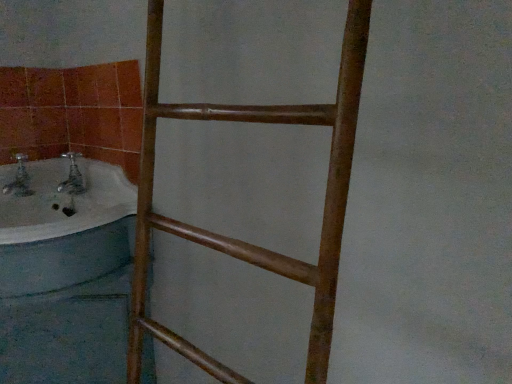
Question: Considering the positions of white glossy bathtub at left and brown wooden ladder at center in the image, is white glossy bathtub at left wider or thinner than brown wooden ladder at center?

Choices:
 (A) thin
 (B) wide

Answer: (B)

Question: Does point (116, 256) appear closer or farther from the camera than point (143, 301)?

Choices:
 (A) closer
 (B) farther

Answer: (A)

Question: Visually, is white glossy bathtub at left positioned to the left or to the right of brown wooden ladder at center?

Choices:
 (A) left
 (B) right

Answer: (A)

Question: From a real-world perspective, is brown wooden ladder at center above or below white glossy bathtub at left?

Choices:
 (A) above
 (B) below

Answer: (A)

Question: Relative to white glossy bathtub at left, is brown wooden ladder at center in front or behind?

Choices:
 (A) front
 (B) behind

Answer: (A)

Question: In terms of width, does brown wooden ladder at center look wider or thinner when compared to white glossy bathtub at left?

Choices:
 (A) wide
 (B) thin

Answer: (B)

Question: Which is correct: brown wooden ladder at center is inside white glossy bathtub at left, or outside of it?

Choices:
 (A) outside
 (B) inside

Answer: (A)